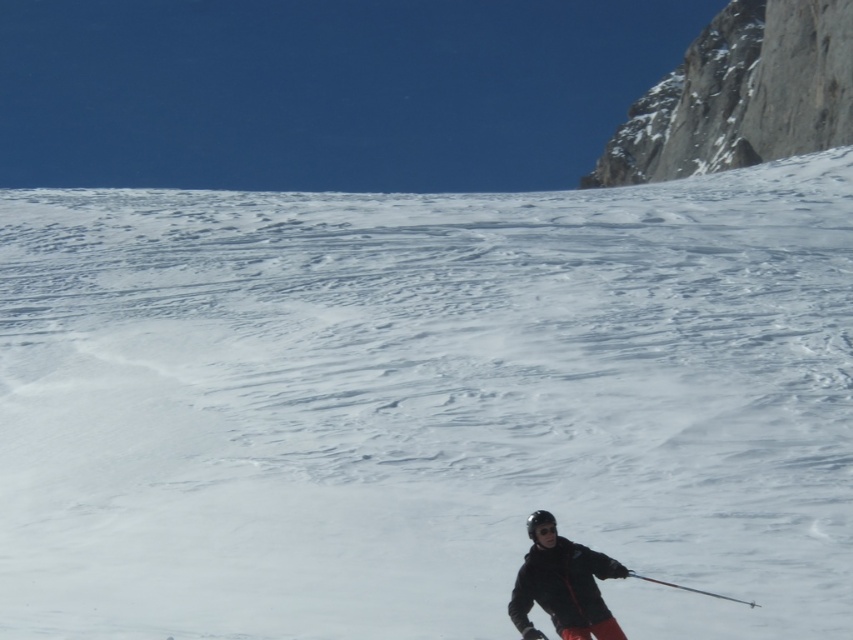
In the scene shown: You are a photographer positioned at the base of the mountain. You want to capture a photo of the black matte jacket at lower right and the rocky cliff at upper right in the same frame. Based on their positions, which object should you adjust your camera to focus on first to ensure both are in the shot?

You should focus on the rocky cliff at upper right first because it is positioned to the right of the black matte jacket at lower right, so adjusting the camera to include the rocky cliff at upper right will naturally include the black matte jacket at lower right in the frame as well.

You are a photographer planning to take a picture of the rocky cliff at upper right and the black matte jacket at lower right. Based on their positions, which object should you focus on first to ensure both are in the frame?

The rocky cliff at upper right is located above the black matte jacket at lower right, so you should focus on the rocky cliff at upper right first to ensure both are in the frame.

You are a drone operator trying to capture a photo of the rocky cliff at upper right. You are currently at point [741,93]. Is the rocky cliff at upper right located at your current position?

Yes, the rocky cliff at upper right is located at point [741,93], so you are already at the correct position to capture the photo.